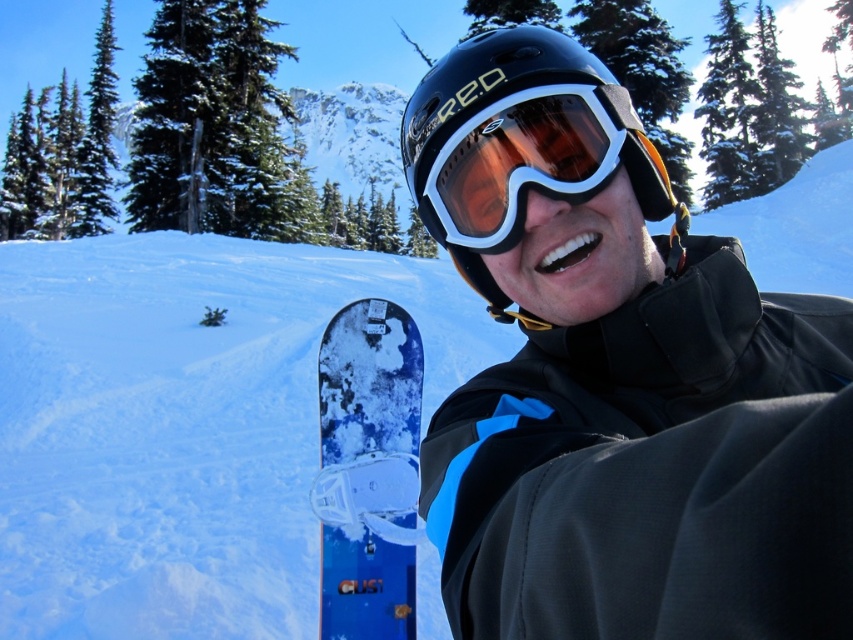
Question: Is black matte snowboard at center further to camera compared to blue matte snowboard at lower center?

Choices:
 (A) no
 (B) yes

Answer: (A)

Question: Is black matte helmet at center further to the viewer compared to matte black goggles at center?

Choices:
 (A) yes
 (B) no

Answer: (A)

Question: Which of the following is the farthest from the observer?

Choices:
 (A) (531, 460)
 (B) (381, 394)

Answer: (B)

Question: Is black matte helmet at center further to camera compared to blue matte snowboard at lower center?

Choices:
 (A) yes
 (B) no

Answer: (B)

Question: Which is nearer to the matte black goggles at center?

Choices:
 (A) black matte helmet at center
 (B) blue matte snowboard at lower center

Answer: (A)

Question: Among these points, which one is farthest from the camera?

Choices:
 (A) (434, 211)
 (B) (345, 380)
 (C) (631, 289)

Answer: (B)